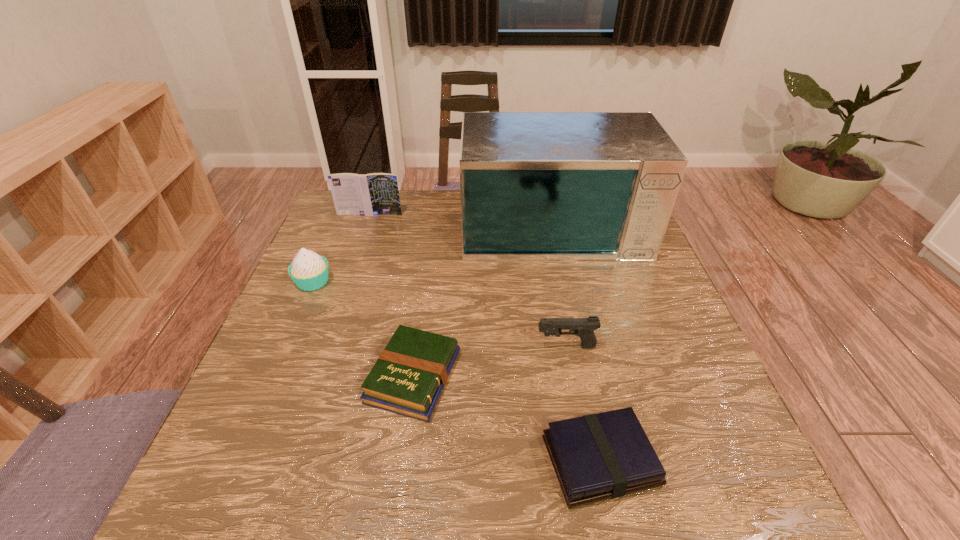
Locate an element on the screen. Image resolution: width=960 pixels, height=540 pixels. vacant space that's between the second book from right to left and the pistol is located at coordinates (490, 361).

Find the location of a particular element. free space between the fourth tallest object and the microwave oven is located at coordinates (559, 284).

You are a GUI agent. You are given a task and a screenshot of the screen. Output one action in this format:
    pyautogui.click(x=<x>, y=<y>)
    Task: Click on the unoccupied area between the rightmost book and the leftmost book
    This screenshot has width=960, height=540.
    Given the screenshot: What is the action you would take?
    pyautogui.click(x=485, y=338)

Where is `free point between the pistol and the tallest object`? The width and height of the screenshot is (960, 540). free point between the pistol and the tallest object is located at coordinates (559, 284).

Where is `vacant space that is in between the second book from left to right and the fourth tallest object`? Image resolution: width=960 pixels, height=540 pixels. vacant space that is in between the second book from left to right and the fourth tallest object is located at coordinates (490, 361).

Locate an element on the screen. This screenshot has height=540, width=960. vacant area between the fourth nearest object and the third shortest object is located at coordinates (x=440, y=314).

Locate an element on the screen. This screenshot has width=960, height=540. vacant point located between the tallest book and the fourth tallest object is located at coordinates (468, 280).

At what (x,y) coordinates should I click in order to perform the action: click on vacant space that is in between the rightmost book and the cupcake. Please return your answer as a coordinate pair (x, y). This screenshot has width=960, height=540. Looking at the image, I should click on (457, 371).

Locate an element on the screen. object that is the third closest to the tallest object is located at coordinates (583, 327).

Identify which object is located as the fifth nearest to the third farthest object. Please provide its 2D coordinates. Your answer should be formatted as a tuple, i.e. [(x, y)], where the tuple contains the x and y coordinates of a point satisfying the conditions above.

[(596, 457)]